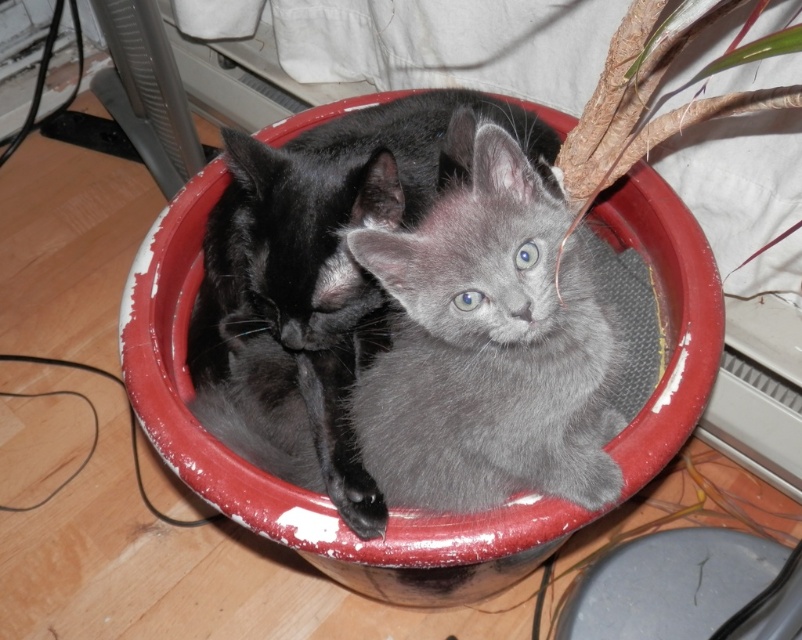
Does gray fluffy cat at center appear over soft gray kitten at center?

No.

Which is above, gray fluffy cat at center or soft gray kitten at center?

soft gray kitten at center

This screenshot has height=640, width=802. I want to click on gray fluffy cat at center, so click(489, 348).

Does soft gray kitten at center lie in front of smooth plastic lid at lower right?

That is True.

Is point (350, 157) more distant than point (734, 588)?

No.

Measure the distance between point (318, 144) and camera.

The distance of point (318, 144) from camera is 1.25 meters.

Find the location of a particular element. soft gray kitten at center is located at coordinates (327, 257).

Is point (424, 291) behind point (600, 616)?

No, (424, 291) is in front of (600, 616).

Who is more distant from viewer, (508, 330) or (666, 561)?

The point (666, 561) is more distant.

Is point (385, 467) closer to viewer compared to point (574, 588)?

That is True.

Find the location of a particular element. gray fluffy cat at center is located at coordinates (489, 348).